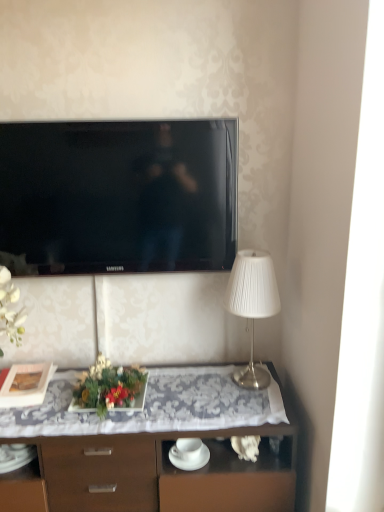
Question: From the image's perspective, is white pleated fabric lampshade at right on wooden desk at center?

Choices:
 (A) yes
 (B) no

Answer: (A)

Question: Can wooden desk at center be found inside white pleated fabric lampshade at right?

Choices:
 (A) no
 (B) yes

Answer: (A)

Question: From a real-world perspective, is white pleated fabric lampshade at right located higher than wooden desk at center?

Choices:
 (A) no
 (B) yes

Answer: (B)

Question: From the image's perspective, is white pleated fabric lampshade at right under wooden desk at center?

Choices:
 (A) no
 (B) yes

Answer: (A)

Question: Would you consider white pleated fabric lampshade at right to be distant from wooden desk at center?

Choices:
 (A) no
 (B) yes

Answer: (A)

Question: Based on their sizes in the image, would you say white pleated fabric lampshade at right is bigger or smaller than wooden desk at center?

Choices:
 (A) small
 (B) big

Answer: (A)

Question: From a real-world perspective, is white pleated fabric lampshade at right positioned above or below wooden desk at center?

Choices:
 (A) below
 (B) above

Answer: (B)

Question: Considering their positions, is white pleated fabric lampshade at right located in front of or behind wooden desk at center?

Choices:
 (A) front
 (B) behind

Answer: (B)

Question: Is white pleated fabric lampshade at right situated inside wooden desk at center or outside?

Choices:
 (A) inside
 (B) outside

Answer: (B)

Question: From the image's perspective, relative to white pleated fabric lampshade at right, is matte black picture frame at left above or below?

Choices:
 (A) below
 (B) above

Answer: (A)

Question: Is point (41, 394) positioned closer to the camera than point (248, 281)?

Choices:
 (A) farther
 (B) closer

Answer: (A)

Question: Looking at their shapes, would you say matte black picture frame at left is wider or thinner than white pleated fabric lampshade at right?

Choices:
 (A) thin
 (B) wide

Answer: (B)

Question: Looking at the image, does matte black picture frame at left seem bigger or smaller compared to white pleated fabric lampshade at right?

Choices:
 (A) small
 (B) big

Answer: (A)

Question: Considering the positions of green leafy plant at center and matte black picture frame at left in the image, is green leafy plant at center wider or thinner than matte black picture frame at left?

Choices:
 (A) wide
 (B) thin

Answer: (A)

Question: From the image's perspective, is green leafy plant at center above or below matte black picture frame at left?

Choices:
 (A) below
 (B) above

Answer: (B)